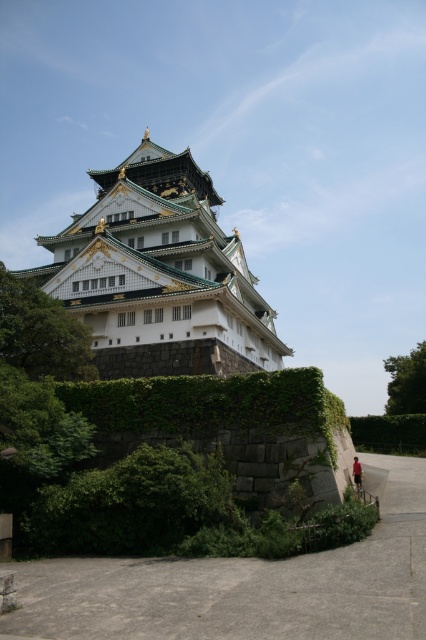
You are standing in front of the Osaka Castle area and want to take a photo that includes both the white stone palace at center and the green leafy hedge at lower right. Based on their positions, which one should you focus on first to ensure both are in frame?

The white stone palace at center is above the green leafy hedge at lower right, so you should focus on the white stone palace at center first to ensure both are in frame.

You are a visitor standing in front of the Osaka Castle area. You see the white stone palace at center and the green leafy hedge at lower right. Which object is taller?

The white stone palace at center is much taller than the green leafy hedge at lower right.